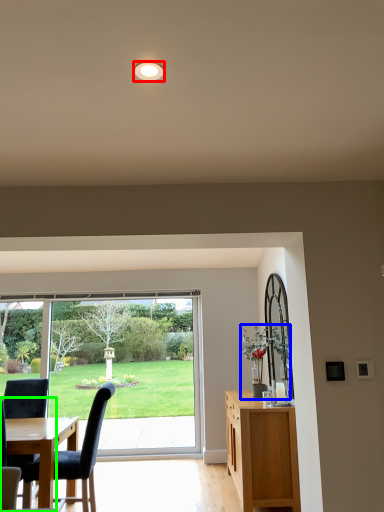
Question: Which object is positioned closest to lighting (highlighted by a red box)? Select from houseplant (highlighted by a blue box) and chair (highlighted by a green box).

Choices:
 (A) houseplant
 (B) chair

Answer: (B)